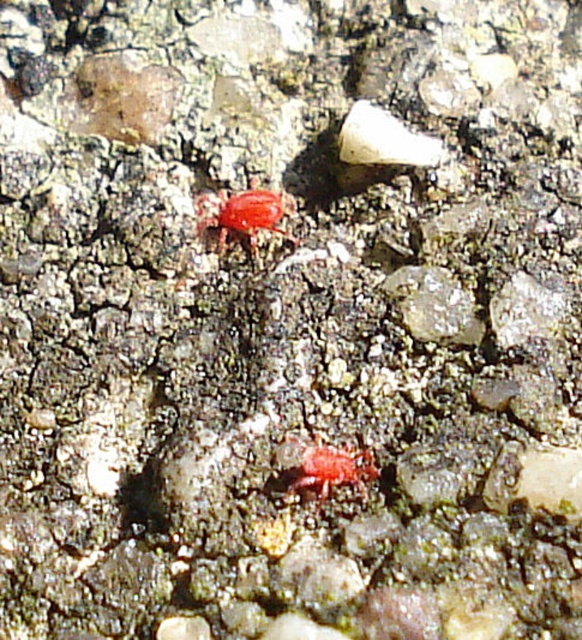
Question: Which point appears farthest from the camera in this image?

Choices:
 (A) (288, 195)
 (B) (307, 480)

Answer: (A)

Question: Which object is closer to the camera taking this photo?

Choices:
 (A) shiny red bug at center
 (B) matte red insect at center

Answer: (B)

Question: Observing the image, what is the correct spatial positioning of shiny red bug at center in reference to matte red insect at center?

Choices:
 (A) left
 (B) right

Answer: (A)

Question: Is shiny red bug at center closer to the viewer compared to matte red insect at center?

Choices:
 (A) yes
 (B) no

Answer: (B)

Question: Which point is closer to the camera taking this photo?

Choices:
 (A) (338, 481)
 (B) (254, 241)

Answer: (A)

Question: Does shiny red bug at center appear on the right side of matte red insect at center?

Choices:
 (A) yes
 (B) no

Answer: (B)